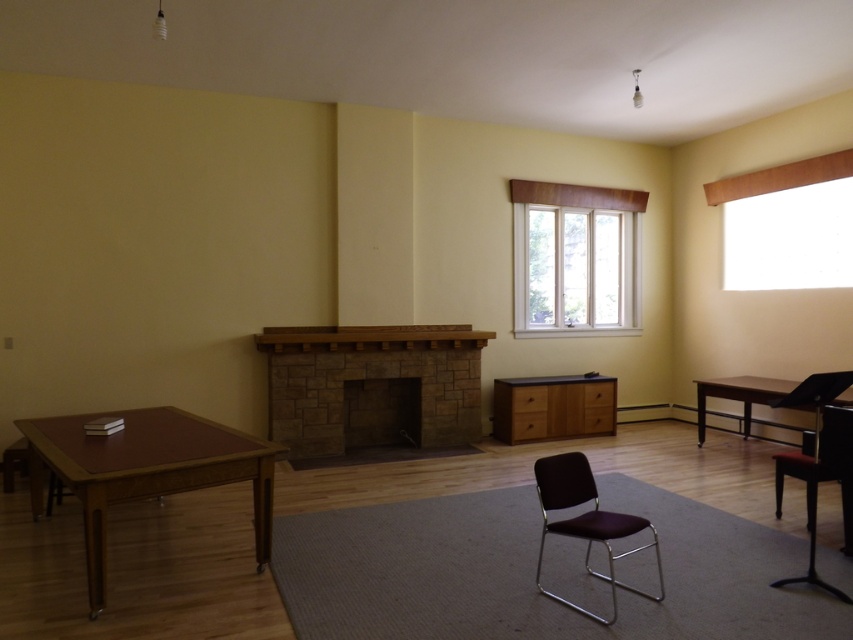
You are standing in the room and want to open the white wood window at center. If you can reach up to 2 meters, can you reach it?

The white wood window at center is 7.34 meters from viewer, so you cannot reach it since your maximum reach is only 2 meters.

You are trying to hang a picture frame that requires a hook placed at the height of the brown stone fireplace at center. The window above it is the white wood window at center. Will the hook be placed below the window?

The brown stone fireplace at center is not as tall as the white wood window at center, so the hook placed at the height of the brown stone fireplace at center will be below the white wood window at center.